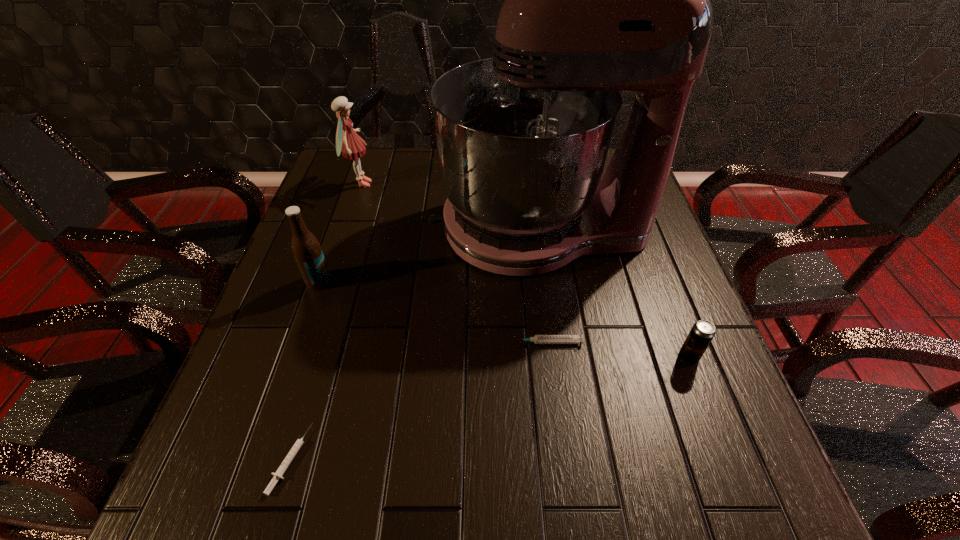
Where is `free space located 0.250m on the front-facing side of the mixer`? free space located 0.250m on the front-facing side of the mixer is located at coordinates (334, 228).

Find the location of a particular element. free space located on the front-facing side of the second tallest object is located at coordinates (445, 184).

You are a GUI agent. You are given a task and a screenshot of the screen. Output one action in this format:
    pyautogui.click(x=<x>, y=<y>)
    Task: Click on the vacant region located on the right of the beer bottle
    
    Given the screenshot: What is the action you would take?
    pyautogui.click(x=487, y=281)

This screenshot has width=960, height=540. I want to click on free space located on the front of the third shortest object, so click(715, 423).

You are a GUI agent. You are given a task and a screenshot of the screen. Output one action in this format:
    pyautogui.click(x=<x>, y=<y>)
    Task: Click on the free location located at the needle end of the taller syringe
    
    Given the screenshot: What is the action you would take?
    [476, 343]

Where is `vacant region located at the needle end of the taller syringe`? The height and width of the screenshot is (540, 960). vacant region located at the needle end of the taller syringe is located at coordinates (369, 343).

Identify the location of vacant space located at the needle end of the taller syringe. (378, 343).

Find the location of a particular element. Image resolution: width=960 pixels, height=540 pixels. vacant region located on the right of the nearest object is located at coordinates (347, 459).

Locate an element on the screen. mixer situated at the far edge is located at coordinates point(598,0).

This screenshot has height=540, width=960. I want to click on doll positioned at the far edge, so click(x=348, y=142).